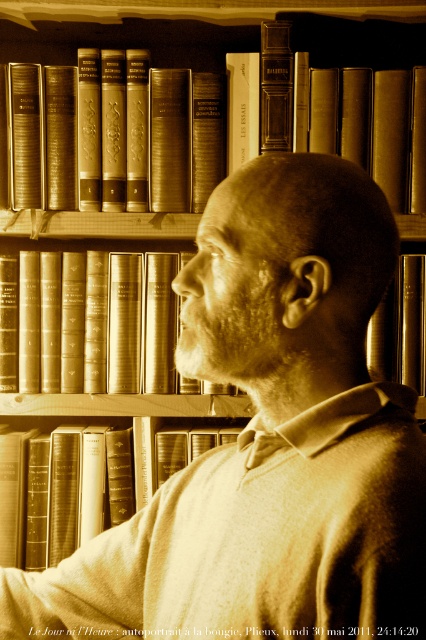
Is hardcover book at center below hardcover book at upper center?

Correct, hardcover book at center is located below hardcover book at upper center.

Which of these two, hardcover book at center or hardcover book at upper center, stands shorter?

Standing shorter between the two is hardcover book at upper center.

Which is in front, point (98, 452) or point (233, 28)?

Positioned in front is point (98, 452).

Where is `hardcover book at center`? The height and width of the screenshot is (640, 426). hardcover book at center is located at coordinates (86, 483).

Which is more to the right, sepia leather book at center or hardcover book at upper center?

hardcover book at upper center

Can you confirm if sepia leather book at center is shorter than hardcover book at upper center?

No, sepia leather book at center is not shorter than hardcover book at upper center.

Where is `sepia leather book at center`? sepia leather book at center is located at coordinates (92, 323).

Is sepia leather book at center further to camera compared to hardcover book at center?

No, sepia leather book at center is closer to the viewer.

You are a GUI agent. You are given a task and a screenshot of the screen. Output one action in this format:
    pyautogui.click(x=<x>, y=<y>)
    Task: Click on the sepia leather book at center
    
    Given the screenshot: What is the action you would take?
    pyautogui.click(x=92, y=323)

Image resolution: width=426 pixels, height=640 pixels. What do you see at coordinates (92, 323) in the screenshot?
I see `sepia leather book at center` at bounding box center [92, 323].

This screenshot has height=640, width=426. I want to click on sepia leather book at center, so point(92,323).